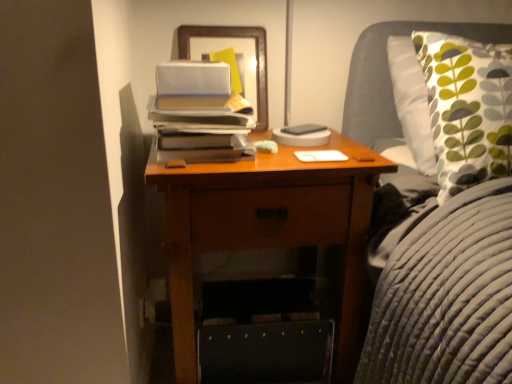
Question: Does wooden nightstand at center have a greater height compared to hardcover book at center?

Choices:
 (A) no
 (B) yes

Answer: (B)

Question: Does wooden nightstand at center have a larger size compared to hardcover book at center?

Choices:
 (A) yes
 (B) no

Answer: (A)

Question: Is wooden nightstand at center smaller than hardcover book at center?

Choices:
 (A) yes
 (B) no

Answer: (B)

Question: Does wooden nightstand at center appear on the right side of hardcover book at center?

Choices:
 (A) no
 (B) yes

Answer: (A)

Question: Would you say wooden nightstand at center contains hardcover book at center?

Choices:
 (A) no
 (B) yes

Answer: (B)

Question: Does point (287, 175) appear closer or farther from the camera than point (244, 34)?

Choices:
 (A) closer
 (B) farther

Answer: (A)

Question: From the image's perspective, is wooden nightstand at center above or below wooden picture frame at upper center?

Choices:
 (A) below
 (B) above

Answer: (A)

Question: From a real-world perspective, is wooden nightstand at center above or below wooden picture frame at upper center?

Choices:
 (A) above
 (B) below

Answer: (B)

Question: In the image, is wooden nightstand at center on the left side or the right side of wooden picture frame at upper center?

Choices:
 (A) left
 (B) right

Answer: (B)

Question: Is wooden picture frame at upper center in front of or behind hardcover book at center in the image?

Choices:
 (A) behind
 (B) front

Answer: (B)

Question: From a real-world perspective, relative to hardcover book at center, is wooden picture frame at upper center vertically above or below?

Choices:
 (A) below
 (B) above

Answer: (B)

Question: Do you think wooden picture frame at upper center is within hardcover book at center, or outside of it?

Choices:
 (A) outside
 (B) inside

Answer: (A)

Question: In terms of height, does wooden picture frame at upper center look taller or shorter compared to hardcover book at center?

Choices:
 (A) short
 (B) tall

Answer: (B)

Question: From the image's perspective, is hardcover book at center positioned above or below wooden nightstand at center?

Choices:
 (A) below
 (B) above

Answer: (B)

Question: In terms of size, does hardcover book at center appear bigger or smaller than wooden nightstand at center?

Choices:
 (A) big
 (B) small

Answer: (B)